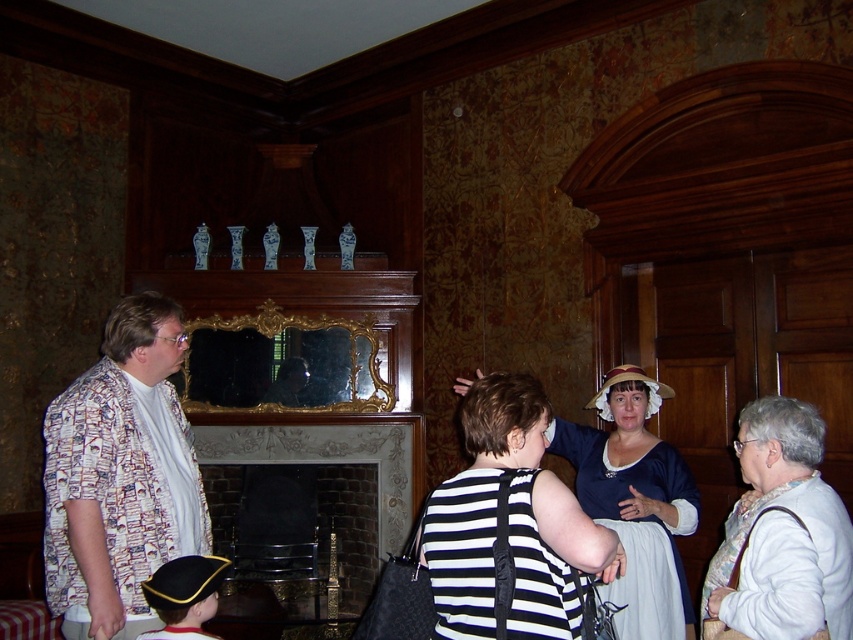
You are a photographer trying to capture the matte blue dress at center and the brick fireplace at center in a single shot. Since the dress is covering part of the fireplace, how can you adjust your camera angle to ensure both are fully visible?

Result: The matte blue dress at center is positioned over the brick fireplace at center. To capture both fully, move the camera to the side so the dress is no longer blocking the fireplace.